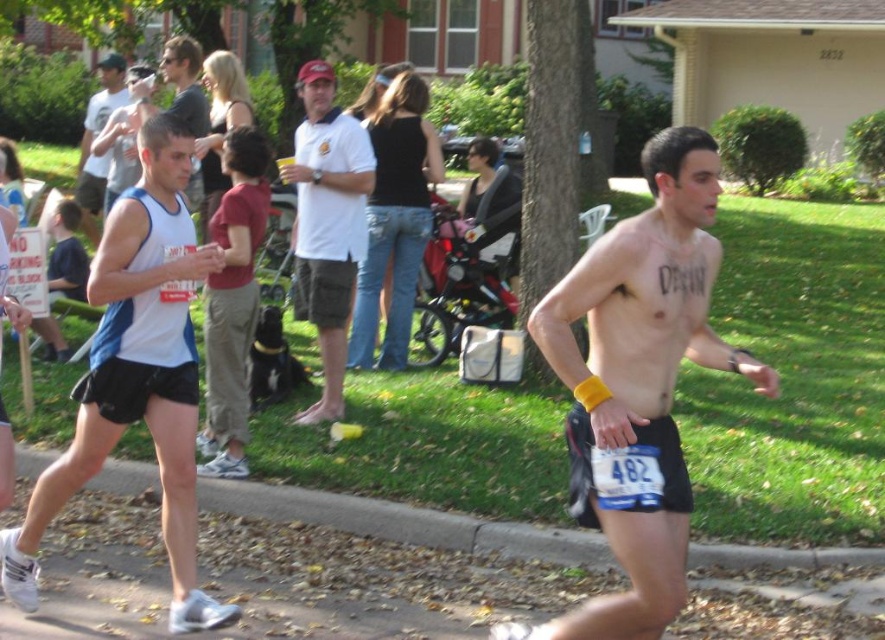
Is shiny black shorts at center above black denim jeans at center?

Incorrect, shiny black shorts at center is not positioned above black denim jeans at center.

Which is above, shiny black shorts at center or black denim jeans at center?

black denim jeans at center is above.

Does point (572, 344) come farther from viewer compared to point (381, 116)?

No, it is not.

Locate an element on the screen. The height and width of the screenshot is (640, 885). shiny black shorts at center is located at coordinates (637, 381).

Does matte white tank top at center appear under matte white tank top at left?

Indeed, matte white tank top at center is positioned under matte white tank top at left.

This screenshot has height=640, width=885. Describe the element at coordinates (174, 93) in the screenshot. I see `matte white tank top at center` at that location.

Is point (190, 42) less distant than point (120, 96)?

Yes, it is in front of point (120, 96).

The height and width of the screenshot is (640, 885). What are the coordinates of `matte white tank top at center` in the screenshot? It's located at pos(174,93).

Is shiny black shorts at center positioned in front of white cotton shirt at center?

Yes.

Does shiny black shorts at center have a lesser height compared to white cotton shirt at center?

Yes, shiny black shorts at center is shorter than white cotton shirt at center.

Identify the location of shiny black shorts at center. (637, 381).